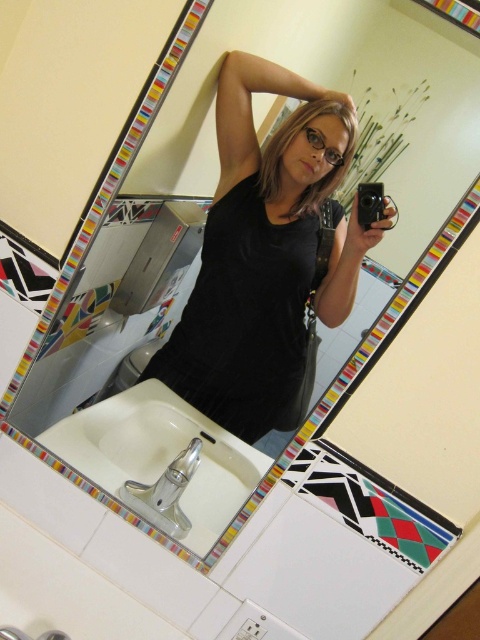
Question: Is black matte tank top at center further to camera compared to white ceramic sink at lower left?

Choices:
 (A) no
 (B) yes

Answer: (B)

Question: In this image, where is black matte tank top at center located relative to white ceramic sink at lower left?

Choices:
 (A) left
 (B) right

Answer: (B)

Question: Can you confirm if black matte tank top at center is wider than white ceramic sink at lower left?

Choices:
 (A) yes
 (B) no

Answer: (A)

Question: Which of the following is the closest to the observer?

Choices:
 (A) white ceramic sink at lower left
 (B) black matte tank top at center

Answer: (A)